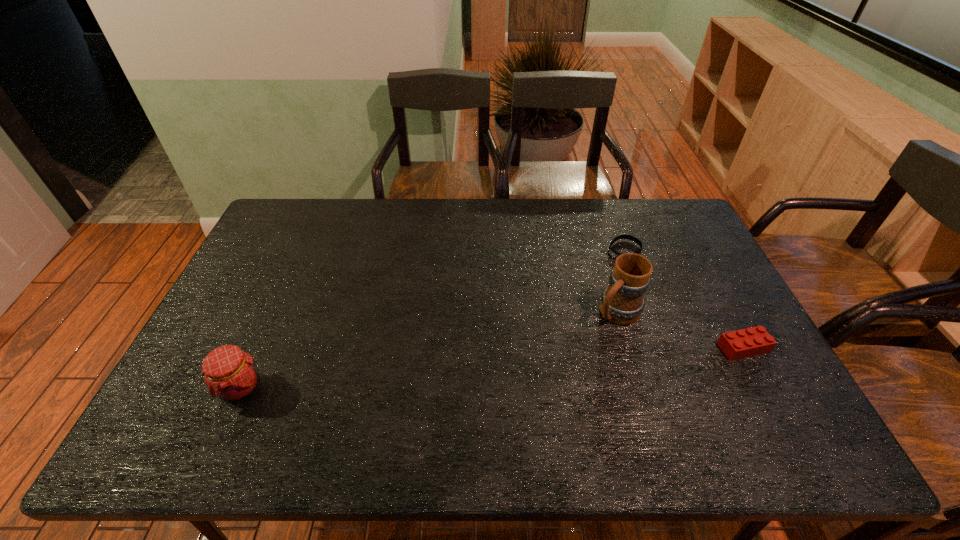
Locate an element on the screen. The height and width of the screenshot is (540, 960). vacant space on the desktop that is between the second tallest object and the second shortest object and is positioned on the display of the wristband is located at coordinates (468, 370).

Locate an element on the screen. free space on the desktop that is between the nearest object and the third farthest object and is positioned on the side of the mug with the handle is located at coordinates (564, 362).